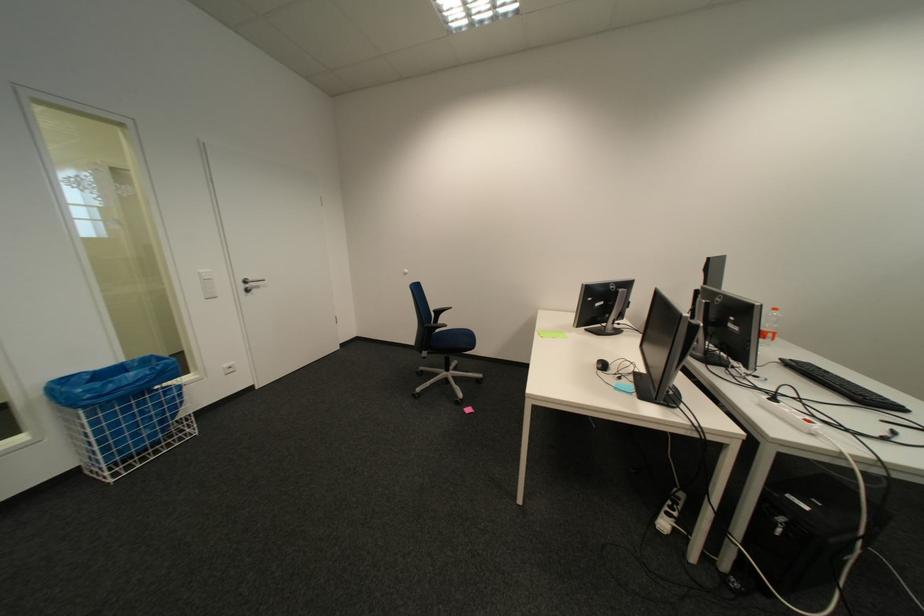
The width and height of the screenshot is (924, 616). Describe the element at coordinates (453, 339) in the screenshot. I see `the blue chair sitting surface` at that location.